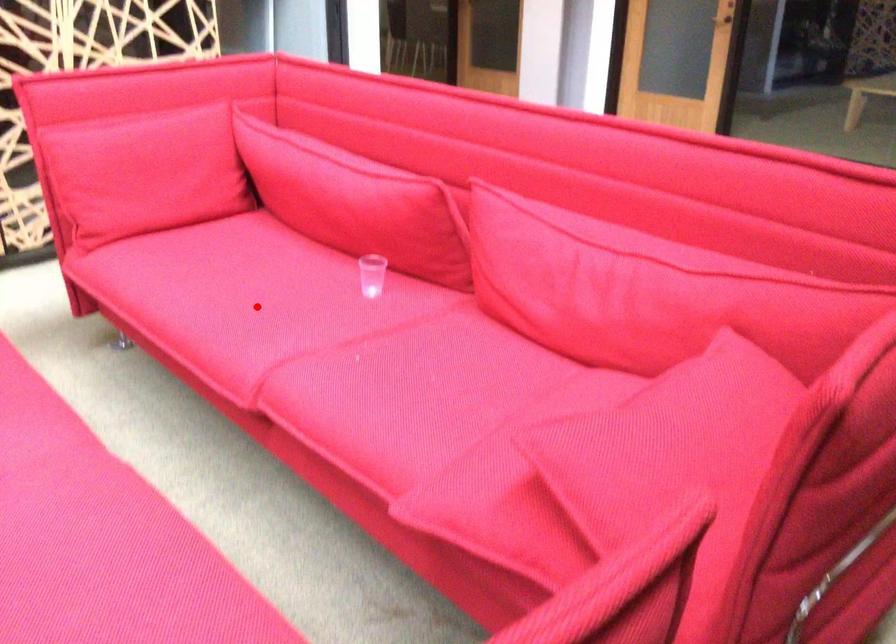
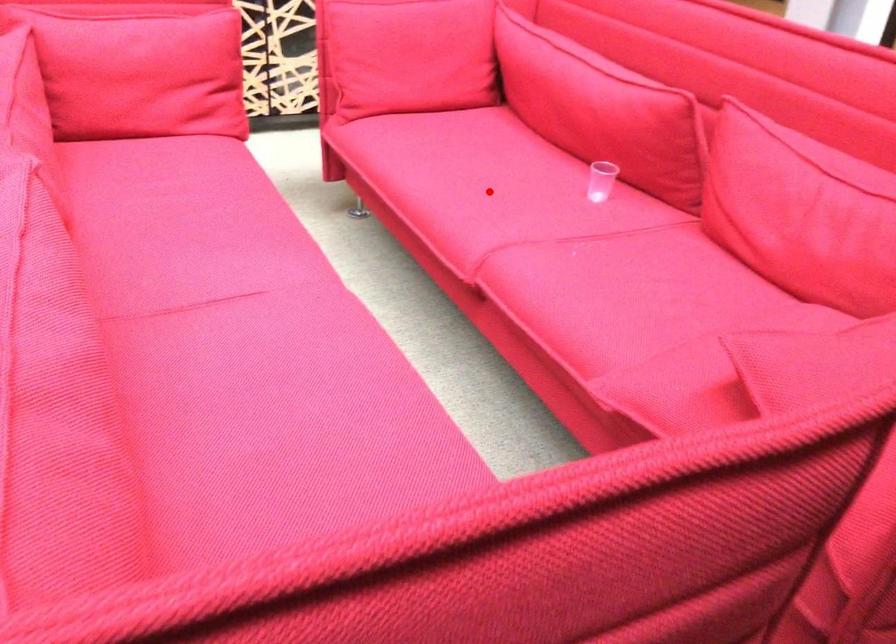
I am providing you with two images of the same scene from different viewpoints. A red point is marked on the first image and another point is marked on the second image. Is the red point in image1 aligned with the point shown in image2?

Yes